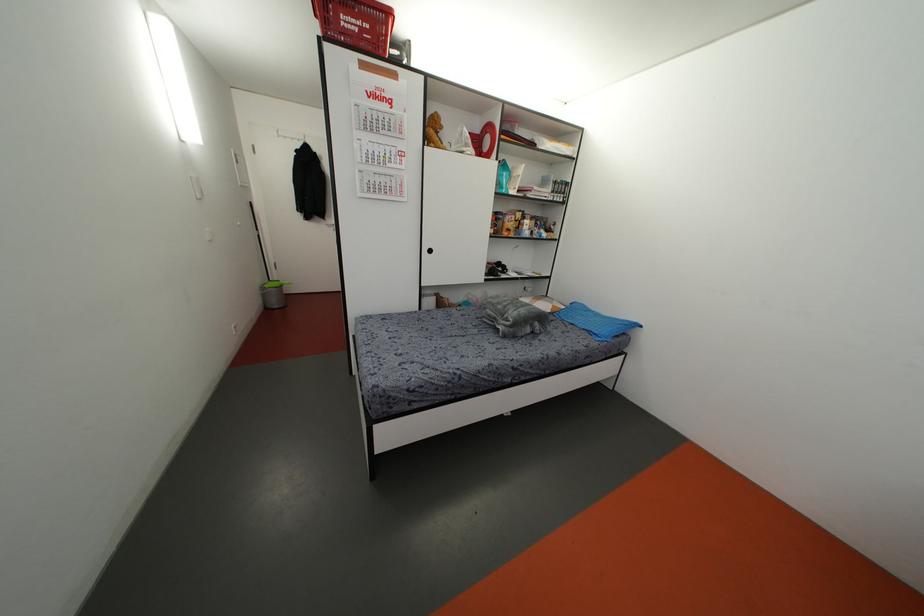
This screenshot has height=616, width=924. Identify the location of white light switch. (196, 187).